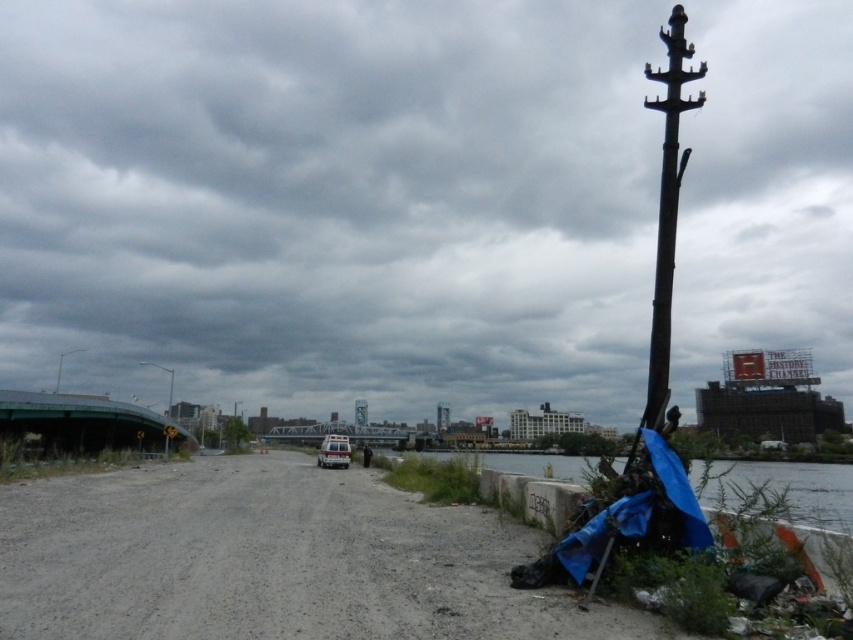
Question: Which point is farther to the camera?

Choices:
 (A) (167, 369)
 (B) (337, 436)
 (C) (498, 538)

Answer: (A)

Question: Where is dark gray metallic pole at right located in relation to metallic gray streetlight at left in the image?

Choices:
 (A) left
 (B) right

Answer: (B)

Question: Which object is positioned farthest from the blue tarpaulin at lower right?

Choices:
 (A) dark gray metallic pole at right
 (B) dirt track at center

Answer: (A)

Question: Can you confirm if dirt track at center is positioned to the left of dark gray metallic pole at right?

Choices:
 (A) no
 (B) yes

Answer: (B)

Question: Estimate the real-world distances between objects in this image. Which object is farther from the blue tarpaulin at lower right?

Choices:
 (A) dark gray metallic pole at right
 (B) dirt track at center
 (C) white matte van at center
 (D) metallic gray streetlight at left

Answer: (D)

Question: Can you confirm if dark gray metallic pole at right is positioned to the left of metallic gray streetlight at left?

Choices:
 (A) no
 (B) yes

Answer: (A)